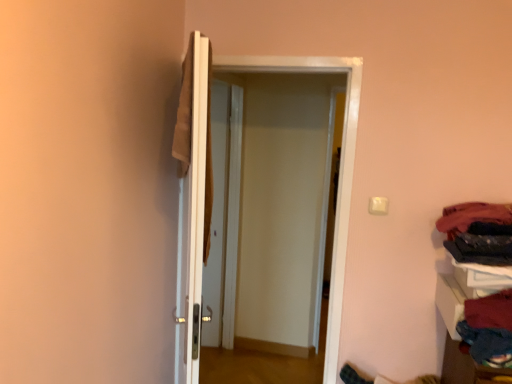
Question: From a real-world perspective, is white glossy door at center, which is the second door from right to left, beneath black fabric at right, positioned as the 2th clothing in bottom-to-top order?

Choices:
 (A) yes
 (B) no

Answer: (A)

Question: Would you consider white glossy door at center, which is the second door from right to left, to be distant from black fabric at right, positioned as the 2th clothing in bottom-to-top order?

Choices:
 (A) yes
 (B) no

Answer: (A)

Question: Considering the relative sizes of white glossy door at center, which is counted as the first door, starting from the left, and black fabric at right, arranged as the second clothing when viewed from the top, in the image provided, is white glossy door at center, which is counted as the first door, starting from the left, bigger than black fabric at right, arranged as the second clothing when viewed from the top,?

Choices:
 (A) no
 (B) yes

Answer: (B)

Question: Is white glossy door at center, which is counted as the first door, starting from the left, positioned beyond the bounds of black fabric at right, arranged as the second clothing when viewed from the top?

Choices:
 (A) yes
 (B) no

Answer: (A)

Question: Is white glossy door at center, which is the second door from right to left, in front of black fabric at right, arranged as the second clothing when viewed from the top?

Choices:
 (A) no
 (B) yes

Answer: (B)

Question: Can you see white glossy door at center, which is the second door from right to left, touching black fabric at right, positioned as the 2th clothing in bottom-to-top order?

Choices:
 (A) no
 (B) yes

Answer: (A)

Question: Is dark blue fabric at right, which is the 1th clothing from top to bottom, facing away from black fabric at right, arranged as the second clothing when viewed from the top?

Choices:
 (A) yes
 (B) no

Answer: (B)

Question: Can you confirm if dark blue fabric at right, which is the 1th clothing from top to bottom, is bigger than black fabric at right, positioned as the 2th clothing in bottom-to-top order?

Choices:
 (A) yes
 (B) no

Answer: (A)

Question: Does dark blue fabric at right, which is the 1th clothing from top to bottom, have a lesser width compared to black fabric at right, positioned as the 2th clothing in bottom-to-top order?

Choices:
 (A) yes
 (B) no

Answer: (B)

Question: Is dark blue fabric at right, the 3th clothing ordered from the bottom, shorter than black fabric at right, positioned as the 2th clothing in bottom-to-top order?

Choices:
 (A) yes
 (B) no

Answer: (B)

Question: Could you tell me if dark blue fabric at right, the 3th clothing ordered from the bottom, is facing black fabric at right, arranged as the second clothing when viewed from the top?

Choices:
 (A) no
 (B) yes

Answer: (A)

Question: Is dark blue fabric at right, the 3th clothing ordered from the bottom, closer to camera compared to black fabric at right, positioned as the 2th clothing in bottom-to-top order?

Choices:
 (A) no
 (B) yes

Answer: (A)

Question: Are white glossy door at center, which is counted as the first door, starting from the right, and velvet red sweater at lower right, which is the 3th clothing in top-to-bottom order, making contact?

Choices:
 (A) no
 (B) yes

Answer: (A)